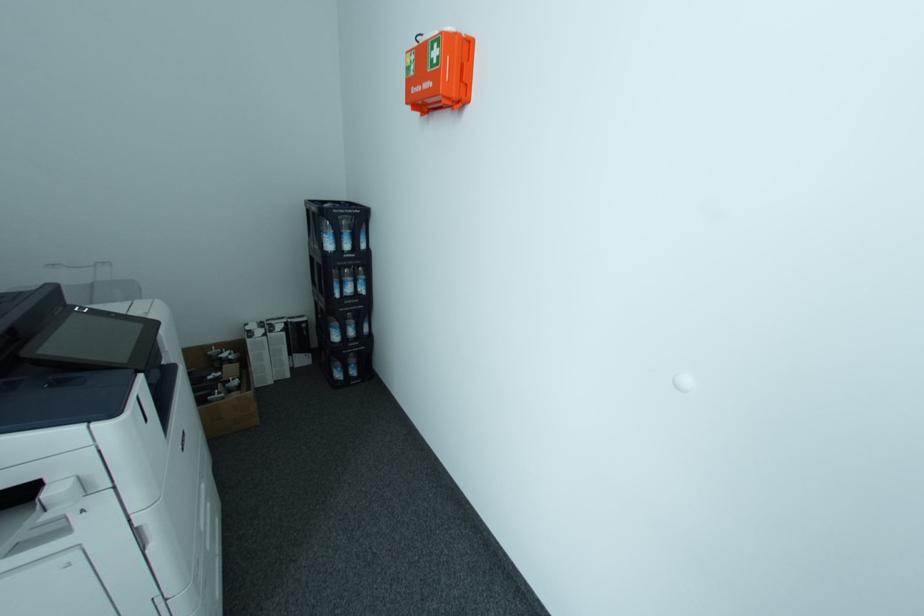
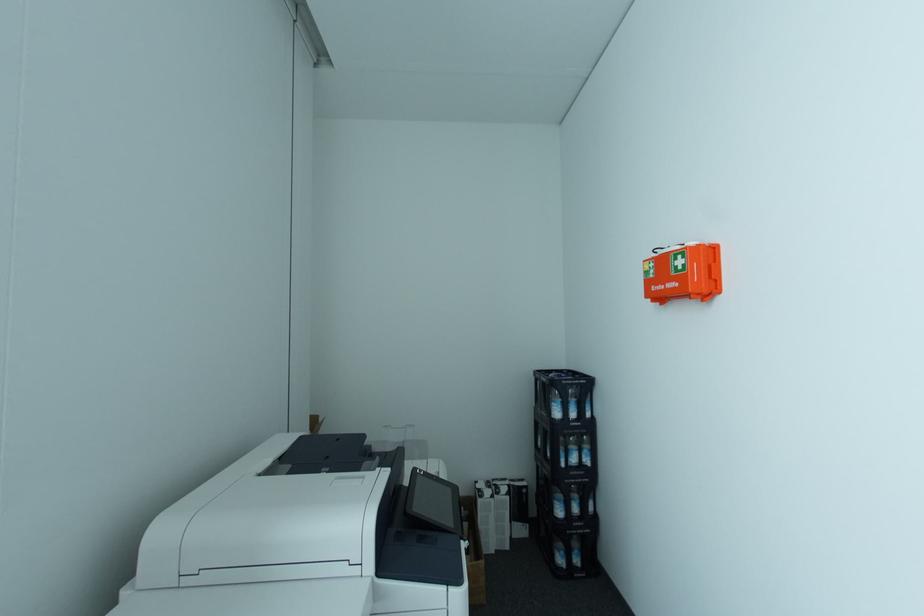
The images are taken continuously from a first-person perspective. In which direction is your viewpoint rotating?

The rotation direction of the camera is left-up.